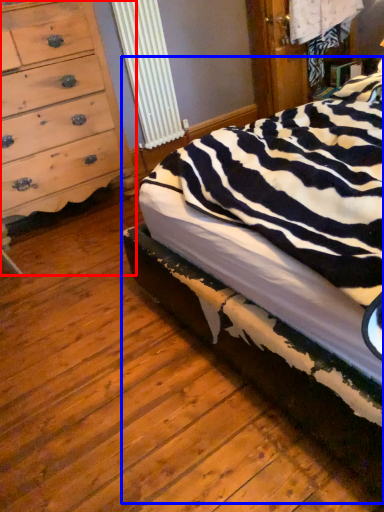
Question: Which point is further to the camera, chest of drawers (highlighted by a red box) or bed (highlighted by a blue box)?

Choices:
 (A) chest of drawers
 (B) bed

Answer: (A)